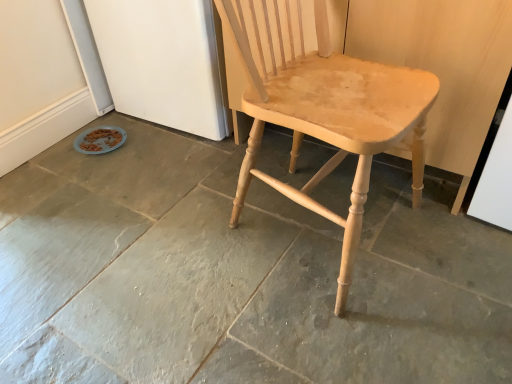
This screenshot has width=512, height=384. I want to click on natural stone floor at center, so click(236, 275).

In order to face natural stone floor at center, should I rotate leftwards or rightwards?

Turn left approximately 6.901 degrees to face it.

Describe the element at coordinates (236, 275) in the screenshot. This screenshot has height=384, width=512. I see `natural stone floor at center` at that location.

What do you see at coordinates (326, 111) in the screenshot? I see `natural wood chair at center` at bounding box center [326, 111].

Locate an element on the screen. Image resolution: width=512 pixels, height=384 pixels. natural wood chair at center is located at coordinates (326, 111).

Locate an element on the screen. This screenshot has width=512, height=384. natural stone floor at center is located at coordinates coord(236,275).

Is natural wood chair at center at the left side of natural stone floor at center?

No.

Is natural wood chair at center further to the viewer compared to natural stone floor at center?

No.

Does point (417, 132) come closer to viewer compared to point (61, 230)?

Yes, it is.

From the image's perspective, between natural wood chair at center and natural stone floor at center, who is located below?

natural stone floor at center is shown below in the image.

In the scene shown: From a real-world perspective, is natural wood chair at center above or below natural stone floor at center?

natural wood chair at center is above natural stone floor at center.

Considering the sizes of objects natural wood chair at center and natural stone floor at center in the image provided, who is thinner, natural wood chair at center or natural stone floor at center?

natural wood chair at center is thinner.

Is natural wood chair at center taller than natural stone floor at center?

Yes.

Consider the image. Considering the sizes of objects natural wood chair at center and natural stone floor at center in the image provided, who is smaller, natural wood chair at center or natural stone floor at center?

natural stone floor at center.

Would you say natural wood chair at center is outside natural stone floor at center?

Indeed, natural wood chair at center is completely outside natural stone floor at center.

Is the surface of natural wood chair at center in direct contact with natural stone floor at center?

No, natural wood chair at center is not making contact with natural stone floor at center.

Could you tell me if natural wood chair at center is facing natural stone floor at center?

No, natural wood chair at center is not facing towards natural stone floor at center.

What's the angular difference between natural wood chair at center and natural stone floor at center's facing directions?

The facing directions of natural wood chair at center and natural stone floor at center are 178 degrees apart.

Image resolution: width=512 pixels, height=384 pixels. Find the location of `chair above the natural stone floor at center (from the image's perspective)`. chair above the natural stone floor at center (from the image's perspective) is located at coordinates (326, 111).

Considering the positions of objects natural stone floor at center and natural wood chair at center in the image provided, who is more to the right, natural stone floor at center or natural wood chair at center?

natural wood chair at center.

Does natural stone floor at center come in front of natural wood chair at center?

No, it is behind natural wood chair at center.

Which is nearer, (41,202) or (300,41)?

Point (300,41)

From the image's perspective, which one is positioned lower, natural stone floor at center or natural wood chair at center?

natural stone floor at center appears lower in the image.

From a real-world perspective, is natural stone floor at center physically located above or below natural wood chair at center?

Clearly, from a real-world perspective, natural stone floor at center is below natural wood chair at center.

In terms of width, does natural stone floor at center look wider or thinner when compared to natural wood chair at center?

Clearly, natural stone floor at center has more width compared to natural wood chair at center.

Who is taller, natural stone floor at center or natural wood chair at center?

With more height is natural wood chair at center.

Does natural stone floor at center have a smaller size compared to natural wood chair at center?

Indeed, natural stone floor at center has a smaller size compared to natural wood chair at center.

Can we say natural stone floor at center lies outside natural wood chair at center?

Yes, natural stone floor at center is not within natural wood chair at center.

Is natural stone floor at center touching natural wood chair at center?

They are not placed beside each other.

Is natural stone floor at center turned away from natural wood chair at center?

No, natural stone floor at center is not facing the opposite direction of natural wood chair at center.

Can you tell me how much natural stone floor at center and natural wood chair at center differ in facing direction?

natural stone floor at center and natural wood chair at center are facing 178 degrees away from each other.

In the scene shown: How distant is natural stone floor at center from natural wood chair at center?

natural stone floor at center is 13.22 inches from natural wood chair at center.

Identify the location of chair that is above the natural stone floor at center (from a real-world perspective). (326, 111).

This screenshot has width=512, height=384. Identify the location of chair above the natural stone floor at center (from the image's perspective). (326, 111).

Find the location of `concrete beneath the natural wood chair at center (from a real-world perspective)`. concrete beneath the natural wood chair at center (from a real-world perspective) is located at coordinates coord(236,275).